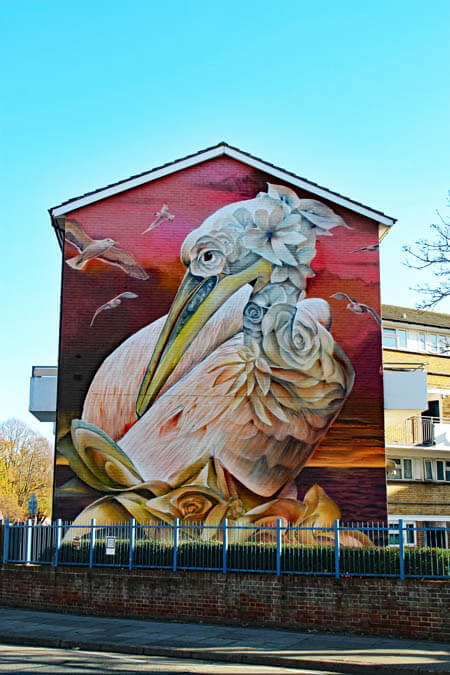
The height and width of the screenshot is (675, 450). Identify the location of windows. (398, 340), (392, 534), (410, 468).